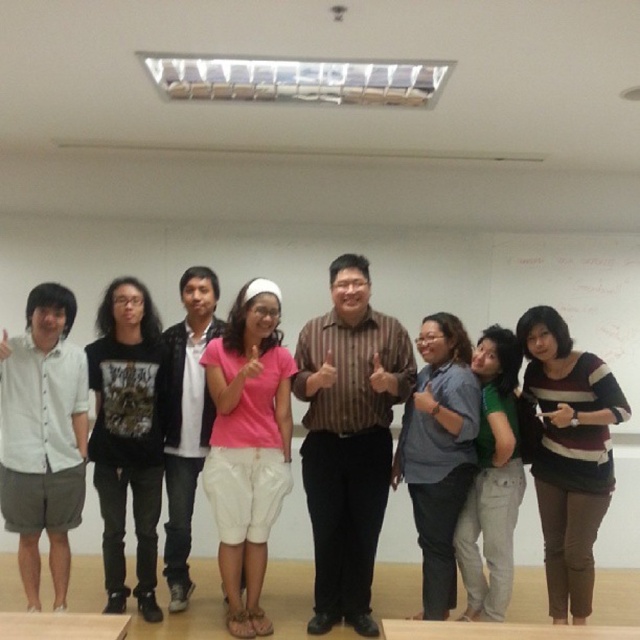
Between light gray cotton shorts at left and striped sweater at center, which one has more height?

With more height is light gray cotton shorts at left.

Which is behind, point (65, 340) or point (570, 465)?

The point (65, 340) is behind.

Where is `light gray cotton shorts at left`? light gray cotton shorts at left is located at coordinates (42, 436).

Where is `light gray cotton shorts at left`? The height and width of the screenshot is (640, 640). light gray cotton shorts at left is located at coordinates (42, 436).

Is point (428, 602) farther from camera compared to point (188, 422)?

That is False.

Can you confirm if blue shirt at center is thinner than white cotton shirt at center?

In fact, blue shirt at center might be wider than white cotton shirt at center.

Identify the location of blue shirt at center. (438, 452).

I want to click on blue shirt at center, so click(x=438, y=452).

Which is behind, point (74, 376) or point (148, 577)?

The point (148, 577) is behind.

Which of these two, light gray cotton shorts at left or black cotton t-shirt at left, stands shorter?

light gray cotton shorts at left is shorter.

Is point (52, 424) less distant than point (141, 531)?

Yes.

Locate an element on the screen. The width and height of the screenshot is (640, 640). light gray cotton shorts at left is located at coordinates click(x=42, y=436).